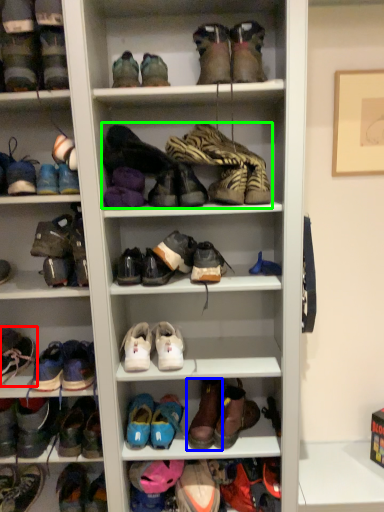
Question: Which is nearer to the footwear (highlighted by a red box)? shoe (highlighted by a blue box) or footwear (highlighted by a green box).

Choices:
 (A) shoe
 (B) footwear

Answer: (A)